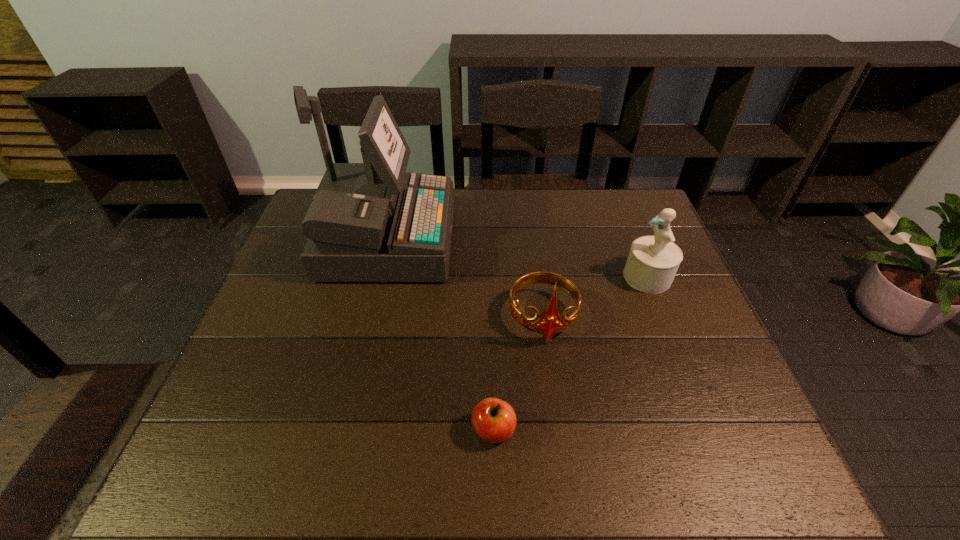
This screenshot has height=540, width=960. What are the coordinates of `object that is the second closest to the cash register` in the screenshot? It's located at (494, 420).

The height and width of the screenshot is (540, 960). Identify the location of object that stands as the third closest to the apple. (652, 263).

At what (x,y) coordinates should I click in order to perform the action: click on free space that satisfies the following two spatial constraints: 1. on the customer-facing side of the nearest object; 2. on the left side of the tallest object. Please return your answer as a coordinate pair (x, y). The image size is (960, 540). Looking at the image, I should click on (340, 430).

Where is `vacant space that satisfies the following two spatial constraints: 1. on the back side of the apple; 2. on the customer-facing side of the tallest object`? The width and height of the screenshot is (960, 540). vacant space that satisfies the following two spatial constraints: 1. on the back side of the apple; 2. on the customer-facing side of the tallest object is located at coordinates (490, 242).

Where is `free space that satisfies the following two spatial constraints: 1. on the customer-facing side of the apple; 2. on the left side of the tallest object`? This screenshot has width=960, height=540. free space that satisfies the following two spatial constraints: 1. on the customer-facing side of the apple; 2. on the left side of the tallest object is located at coordinates [340, 430].

I want to click on vacant point that satisfies the following two spatial constraints: 1. on the customer-facing side of the shortest object; 2. on the left side of the cash register, so click(340, 430).